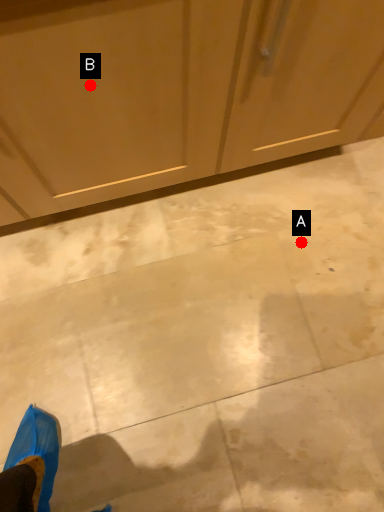
Question: Two points are circled on the image, labeled by A and B beside each circle. Which of the following is the closest to the observer?

Choices:
 (A) A is closer
 (B) B is closer

Answer: (B)